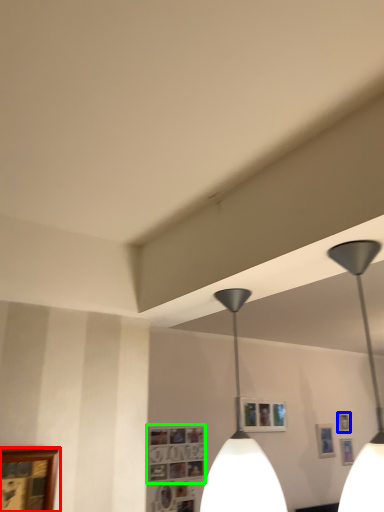
Question: Which object is positioned farthest from picture frame (highlighted by a red box)? Select from picture frame (highlighted by a blue box) and picture frame (highlighted by a green box).

Choices:
 (A) picture frame
 (B) picture frame

Answer: (A)